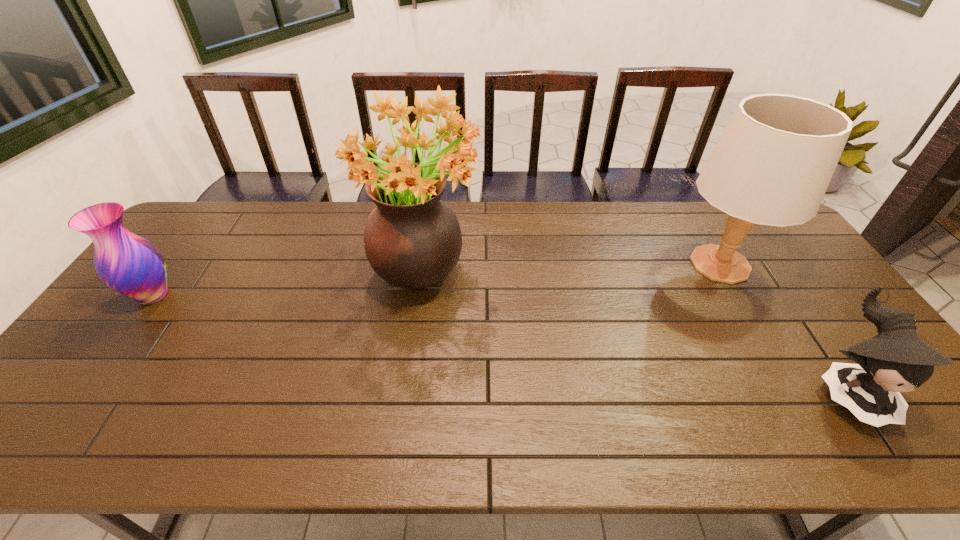
Identify which object is the nearest to the table lamp. Please provide its 2D coordinates. Your answer should be formatted as a tuple, i.e. [(x, y)], where the tuple contains the x and y coordinates of a point satisfying the conditions above.

[(896, 360)]

The image size is (960, 540). Find the location of `vacant region that satisfies the following two spatial constraints: 1. on the back side of the table lamp; 2. on the left side of the vase`. vacant region that satisfies the following two spatial constraints: 1. on the back side of the table lamp; 2. on the left side of the vase is located at coordinates (176, 264).

I want to click on vacant position in the image that satisfies the following two spatial constraints: 1. on the back side of the leftmost object; 2. on the left side of the table lamp, so click(176, 264).